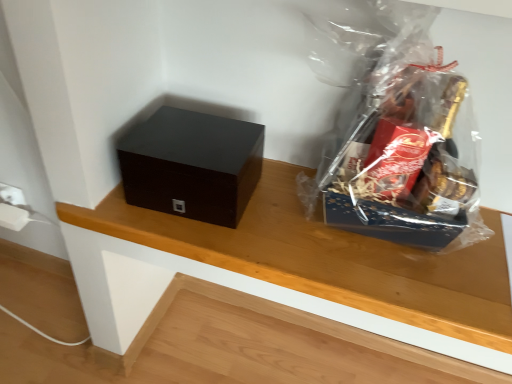
Question: Considering the positions of point pyautogui.click(x=495, y=347) and point pyautogui.click(x=357, y=226), is point pyautogui.click(x=495, y=347) closer or farther from the camera than point pyautogui.click(x=357, y=226)?

Choices:
 (A) farther
 (B) closer

Answer: (B)

Question: Which is correct: wooden table at center is inside transparent plastic gift basket at upper right, or outside of it?

Choices:
 (A) outside
 (B) inside

Answer: (A)

Question: Which is farther from the transparent plastic gift basket at upper right?

Choices:
 (A) wooden table at center
 (B) matte black box at left

Answer: (B)

Question: Which object is positioned farthest from the transparent plastic gift basket at upper right?

Choices:
 (A) wooden table at center
 (B) matte black box at left

Answer: (B)